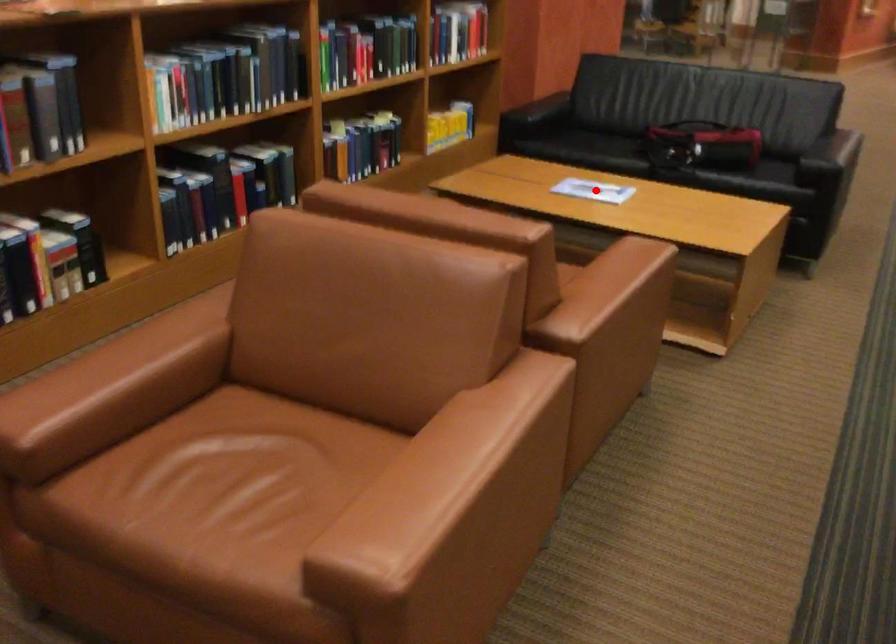
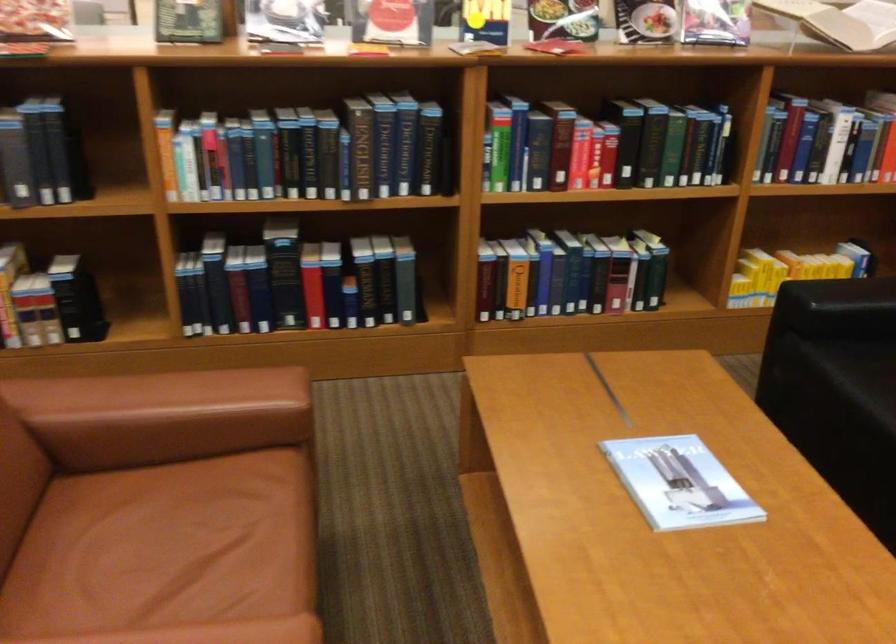
Locate, in the second image, the point that corresponds to the highlighted location in the first image.

(678, 483)